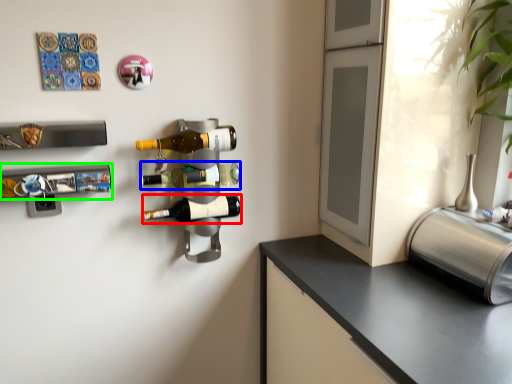
Question: Which is farther away from beer bottle (highlighted by a red box)? beer bottle (highlighted by a blue box) or wine rack (highlighted by a green box)?

Choices:
 (A) beer bottle
 (B) wine rack

Answer: (B)